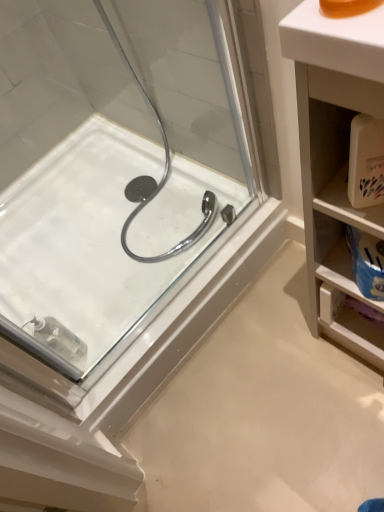
Question: Considering their positions, is white plastic cabinet at right located in front of or behind white glossy bath at center?

Choices:
 (A) behind
 (B) front

Answer: (B)

Question: From a real-world perspective, is white plastic cabinet at right physically located above or below white glossy bath at center?

Choices:
 (A) below
 (B) above

Answer: (B)

Question: From the image's perspective, is white plastic cabinet at right positioned above or below white glossy bath at center?

Choices:
 (A) above
 (B) below

Answer: (B)

Question: Considering the positions of white glossy bath at center and white plastic cabinet at right in the image, is white glossy bath at center taller or shorter than white plastic cabinet at right?

Choices:
 (A) tall
 (B) short

Answer: (B)

Question: Relative to white plastic cabinet at right, is white glossy bath at center in front or behind?

Choices:
 (A) front
 (B) behind

Answer: (B)

Question: Considering the positions of point (235, 201) and point (367, 325), is point (235, 201) closer or farther from the camera than point (367, 325)?

Choices:
 (A) closer
 (B) farther

Answer: (B)

Question: Would you say white glossy bath at center is inside or outside white plastic cabinet at right?

Choices:
 (A) outside
 (B) inside

Answer: (A)